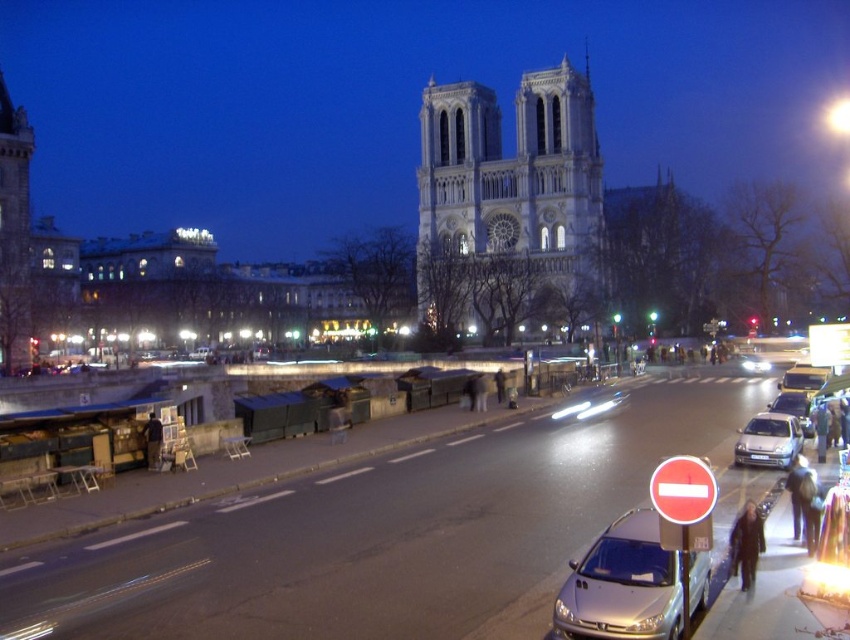
Between point (466, 131) and point (656, 632), which one is positioned behind?

Point (466, 131)

The height and width of the screenshot is (640, 850). What do you see at coordinates (508, 196) in the screenshot?
I see `white stone cathedral at center` at bounding box center [508, 196].

Where is `white stone cathedral at center`? white stone cathedral at center is located at coordinates (508, 196).

You are a GUI agent. You are given a task and a screenshot of the screen. Output one action in this format:
    pyautogui.click(x=<x>, y=<y>)
    Task: Click on the white stone cathedral at center
    This screenshot has width=850, height=640.
    Given the screenshot: What is the action you would take?
    pyautogui.click(x=508, y=196)

Can you confirm if white stone cathedral at center is thinner than shiny silver car at center?

Incorrect, white stone cathedral at center's width is not less than shiny silver car at center's.

What do you see at coordinates (508, 196) in the screenshot? I see `white stone cathedral at center` at bounding box center [508, 196].

Locate an element on the screen. The image size is (850, 640). white stone cathedral at center is located at coordinates (508, 196).

Does satin silver car at lower right appear on the left side of metallic silver sedan at center?

Yes, satin silver car at lower right is to the left of metallic silver sedan at center.

Does point (756, 440) come in front of point (799, 416)?

Yes, point (756, 440) is closer to viewer.

Where is `satin silver car at lower right`? The height and width of the screenshot is (640, 850). satin silver car at lower right is located at coordinates (768, 440).

Find the location of `satin silver car at lower right`. satin silver car at lower right is located at coordinates (768, 440).